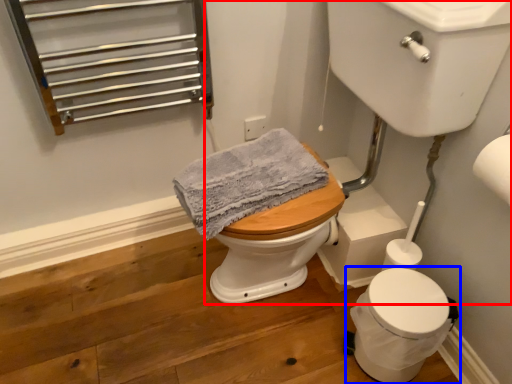
Question: Which object appears farthest to the camera in this image, sink (highlighted by a red box) or toilet (highlighted by a blue box)?

Choices:
 (A) sink
 (B) toilet

Answer: (B)